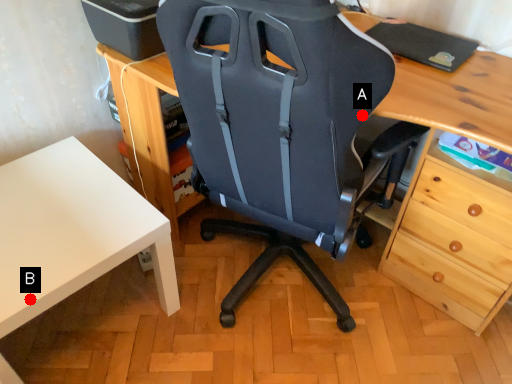
Question: Two points are circled on the image, labeled by A and B beside each circle. Which point is closer to the camera?

Choices:
 (A) A is closer
 (B) B is closer

Answer: (A)